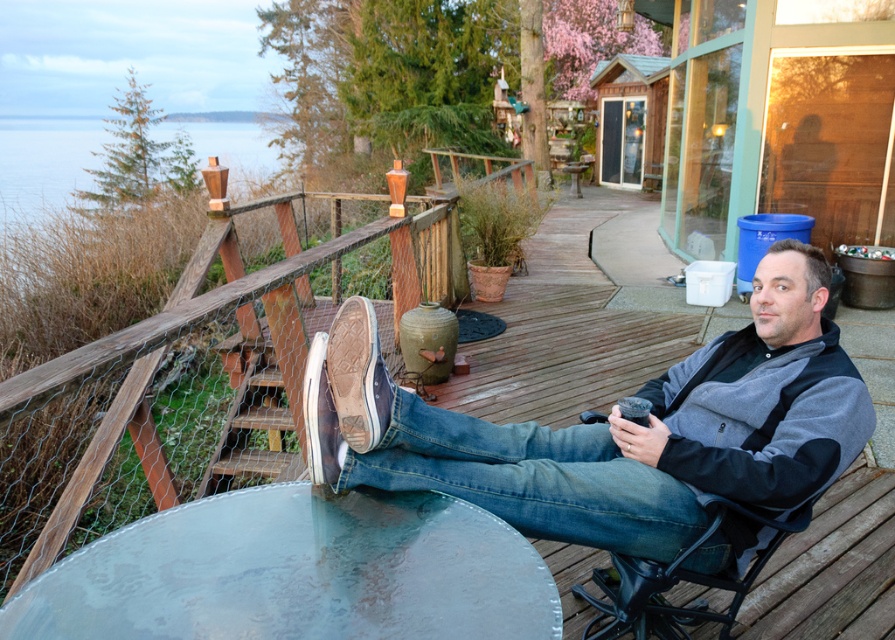
You are designing a new outfit and want to ensure it complements the scene. Given the denim jeans at center and the wooden rail at upper left, which item has a greater width?

The denim jeans at center has a greater width than the wooden rail at upper left according to the description.

You are a photographer setting up a shot of the denim jeans at center and the black metal chair at right. To ensure both are in frame, should you adjust your camera to the left or right side of the scene?

The denim jeans at center is positioned on the left side of black metal chair at right, so adjusting the camera to the left would keep both in frame.